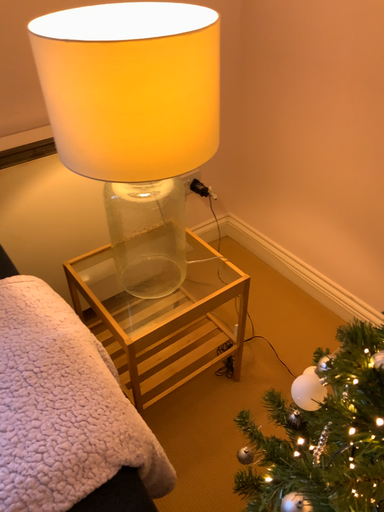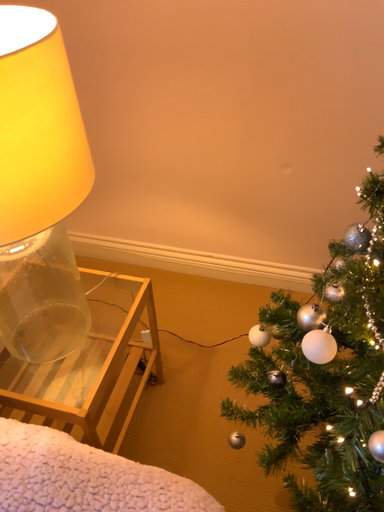
Question: Which way did the camera rotate in the video?

Choices:
 (A) rotated left
 (B) rotated right

Answer: (B)